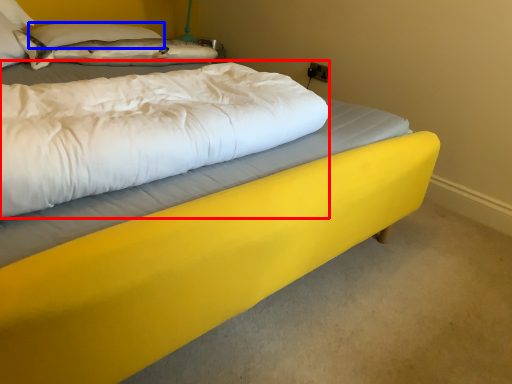
Question: Which object appears farthest to the camera in this image, mattress (highlighted by a red box) or pillow (highlighted by a blue box)?

Choices:
 (A) mattress
 (B) pillow

Answer: (B)